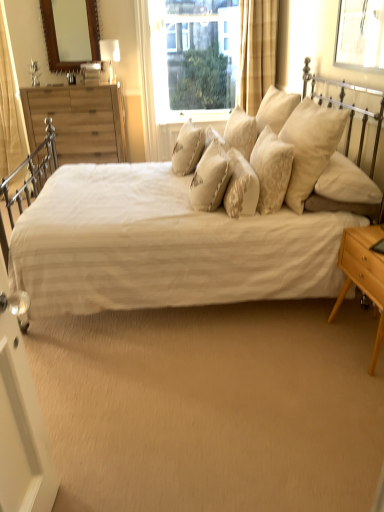
What are the coordinates of `vacant area located to the right-hand side of white glossy screen door at lower left` in the screenshot? It's located at 93,492.